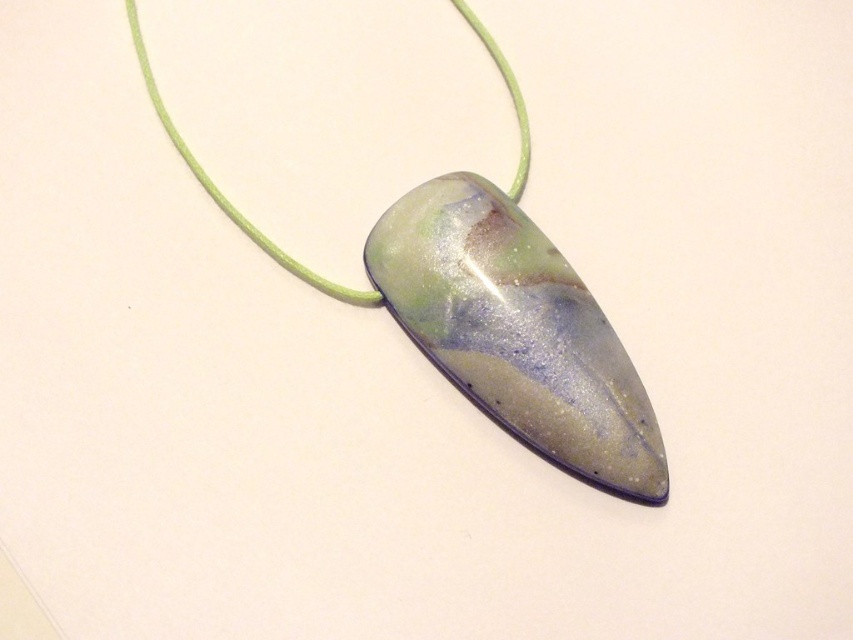
Question: Is translucent glass pendant at center closer to the viewer compared to translucent marbled stone pendant at center?

Choices:
 (A) yes
 (B) no

Answer: (B)

Question: Is translucent glass pendant at center thinner than translucent marbled stone pendant at center?

Choices:
 (A) no
 (B) yes

Answer: (A)

Question: Among these objects, which one is nearest to the camera?

Choices:
 (A) translucent glass pendant at center
 (B) translucent marbled stone pendant at center

Answer: (B)

Question: Which object is closer to the camera taking this photo?

Choices:
 (A) translucent marbled stone pendant at center
 (B) translucent glass pendant at center

Answer: (A)

Question: Considering the relative positions of translucent glass pendant at center and translucent marbled stone pendant at center in the image provided, where is translucent glass pendant at center located with respect to translucent marbled stone pendant at center?

Choices:
 (A) left
 (B) right

Answer: (A)

Question: Which of the following is the closest to the observer?

Choices:
 (A) translucent glass pendant at center
 (B) translucent marbled stone pendant at center

Answer: (B)